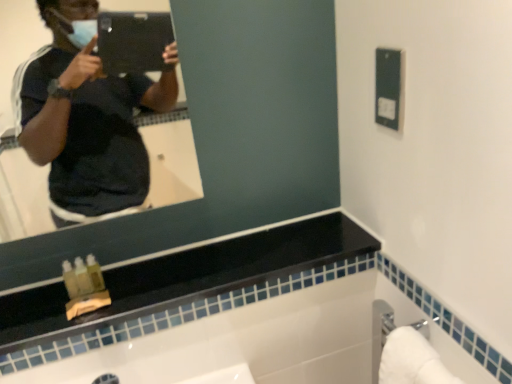
Question: Looking at their shapes, would you say black glossy counter top at upper center is wider or thinner than silver metallic towel bar at lower right?

Choices:
 (A) thin
 (B) wide

Answer: (B)

Question: Do you think black glossy counter top at upper center is within silver metallic towel bar at lower right, or outside of it?

Choices:
 (A) outside
 (B) inside

Answer: (A)

Question: In the image, is black glossy counter top at upper center on the left side or the right side of silver metallic towel bar at lower right?

Choices:
 (A) left
 (B) right

Answer: (A)

Question: Is silver metallic towel bar at lower right inside or outside of black glossy counter top at upper center?

Choices:
 (A) outside
 (B) inside

Answer: (A)

Question: From the image's perspective, is silver metallic towel bar at lower right positioned above or below black glossy counter top at upper center?

Choices:
 (A) below
 (B) above

Answer: (A)

Question: From a real-world perspective, is silver metallic towel bar at lower right above or below black glossy counter top at upper center?

Choices:
 (A) below
 (B) above

Answer: (A)

Question: Is silver metallic towel bar at lower right taller or shorter than black glossy counter top at upper center?

Choices:
 (A) short
 (B) tall

Answer: (B)